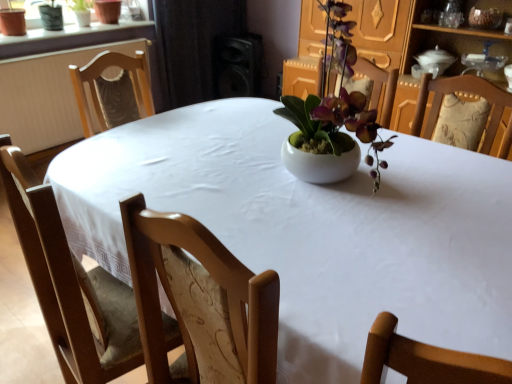
Question: Looking at the image, does green matte plant at upper left seem bigger or smaller compared to black matte speaker at upper center?

Choices:
 (A) big
 (B) small

Answer: (B)

Question: From the image's perspective, is green matte plant at upper left located above or below black matte speaker at upper center?

Choices:
 (A) below
 (B) above

Answer: (B)

Question: Would you say green matte plant at upper left is inside or outside black matte speaker at upper center?

Choices:
 (A) inside
 (B) outside

Answer: (B)

Question: From a real-world perspective, is black matte speaker at upper center positioned above or below green matte plant at upper left?

Choices:
 (A) below
 (B) above

Answer: (A)

Question: Looking at the image, does black matte speaker at upper center seem bigger or smaller compared to green matte plant at upper left?

Choices:
 (A) big
 (B) small

Answer: (A)

Question: Is point (242, 39) positioned closer to the camera than point (83, 4)?

Choices:
 (A) farther
 (B) closer

Answer: (A)

Question: In terms of width, does black matte speaker at upper center look wider or thinner when compared to green matte plant at upper left?

Choices:
 (A) wide
 (B) thin

Answer: (A)